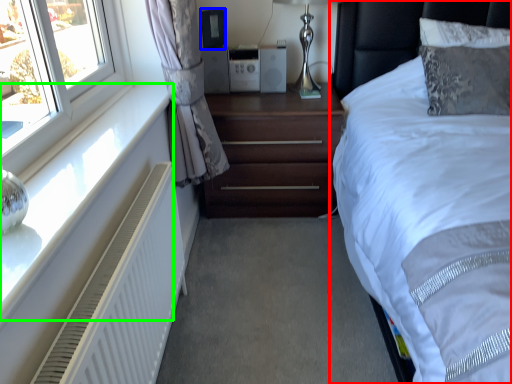
Question: Estimate the real-world distances between objects in this image. Which object is farther from bed (highlighted by a red box), speaker (highlighted by a blue box) or window sill (highlighted by a green box)?

Choices:
 (A) speaker
 (B) window sill

Answer: (B)